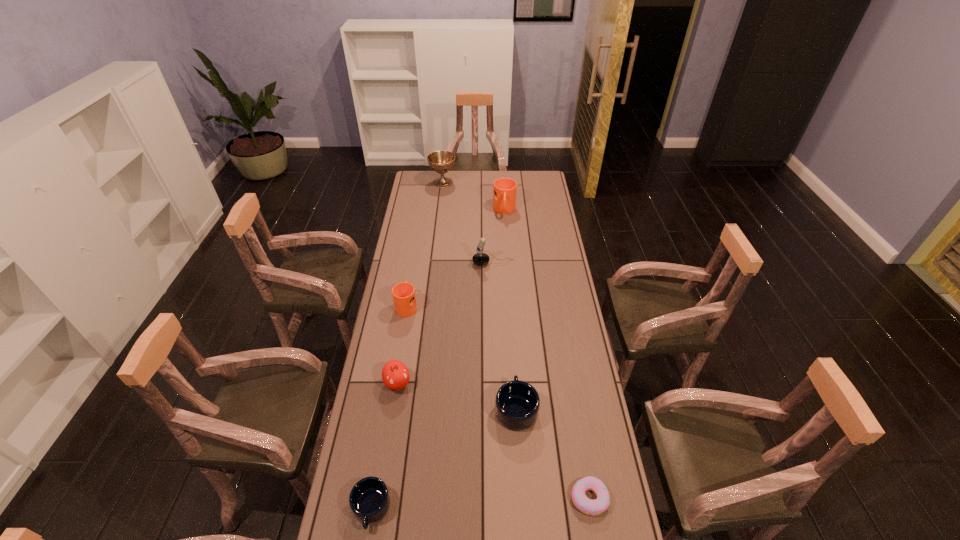
Find the location of `chalice`. chalice is located at coordinates (440, 161).

I want to click on red chalice, so click(x=440, y=161).

Locate an element on the screen. This screenshot has height=540, width=960. the right orange mug is located at coordinates (504, 189).

Image resolution: width=960 pixels, height=540 pixels. I want to click on the bigger orange mug, so click(x=504, y=189).

I want to click on the sixth nearest object, so click(x=479, y=258).

At what (x,y) coordinates should I click in order to perform the action: click on white microphone. Please return your answer as a coordinate pair (x, y). Looking at the image, I should click on (479, 258).

You are a GUI agent. You are given a task and a screenshot of the screen. Output one action in this format:
    pyautogui.click(x=<x>, y=<y>)
    Task: Click on the smaller orange mug
    
    Given the screenshot: What is the action you would take?
    pyautogui.click(x=404, y=298)

At what (x,y) coordinates should I click in order to perform the action: click on the left orange mug. Please return your answer as a coordinate pair (x, y). This screenshot has height=540, width=960. Looking at the image, I should click on (404, 298).

Where is `apple`? apple is located at coordinates tap(395, 375).

Where is `the bigger blue mug`? Image resolution: width=960 pixels, height=540 pixels. the bigger blue mug is located at coordinates [517, 403].